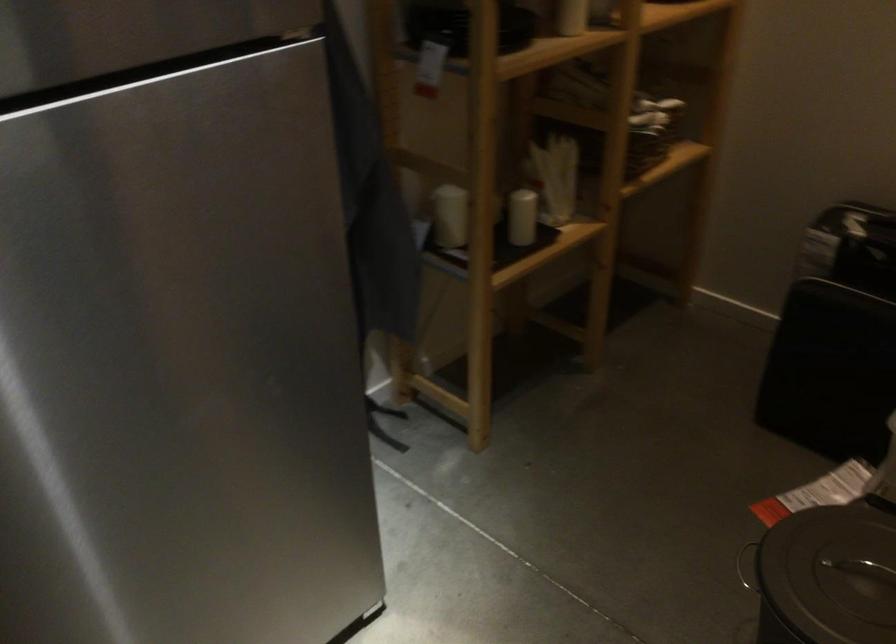
Find where to pull the refrigerator door edge. Please return your answer as a coordinate pair (x, y).

(322, 24)